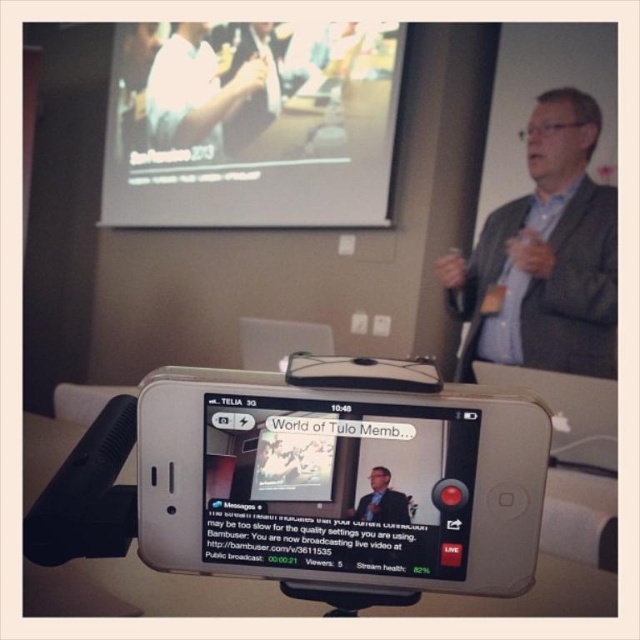
Question: Is matte black smartphone at center positioned before gray textured blazer at upper right?

Choices:
 (A) no
 (B) yes

Answer: (B)

Question: From the image, what is the correct spatial relationship of gray textured blazer at upper right in relation to matte black suit at center?

Choices:
 (A) left
 (B) right

Answer: (B)

Question: Which point is closer to the camera taking this photo?

Choices:
 (A) (376, 477)
 (B) (284, 572)
 (C) (196, 58)

Answer: (A)

Question: Does matte white projector screen at upper center have a smaller size compared to matte black suit at center?

Choices:
 (A) yes
 (B) no

Answer: (B)

Question: Considering the real-world distances, which object is closest to the white matte shirt at upper left?

Choices:
 (A) matte white projector screen at upper center
 (B) silver metallic phone at center
 (C) matte black smartphone at center

Answer: (A)

Question: Which of these objects is positioned closest to the matte white projector screen at upper center?

Choices:
 (A) silver metallic phone at center
 (B) matte black smartphone at center
 (C) gray textured blazer at upper right
 (D) white matte shirt at upper left

Answer: (D)